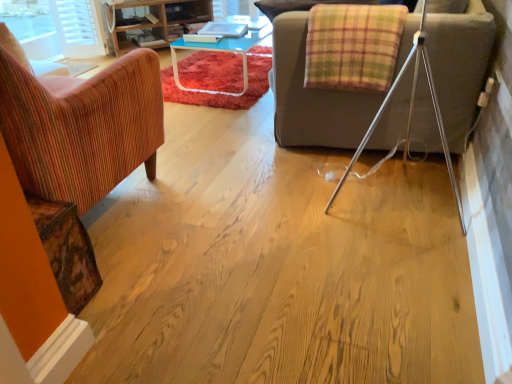
Locate an element on the screen. The image size is (512, 384). spots to the right of wooden textured armchair at left is located at coordinates (227, 254).